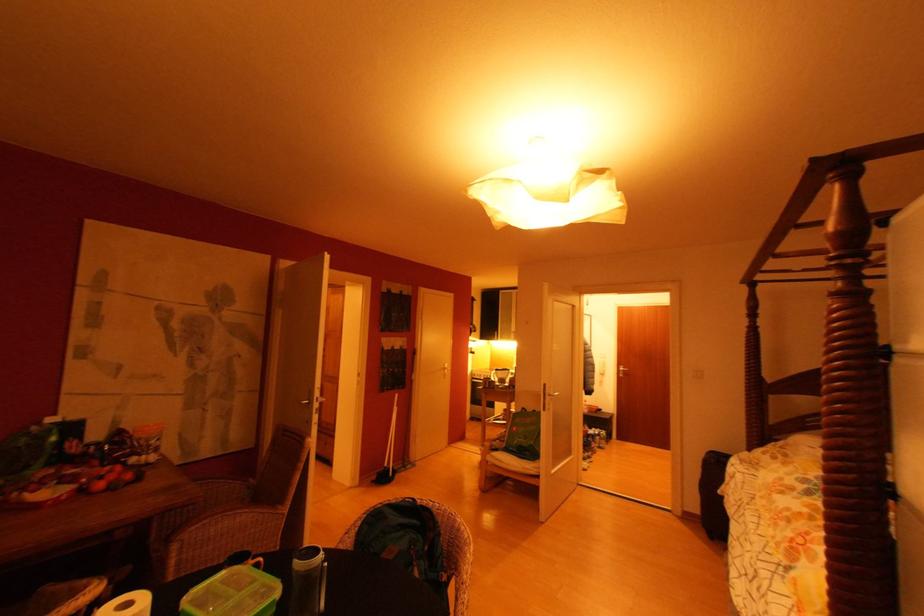
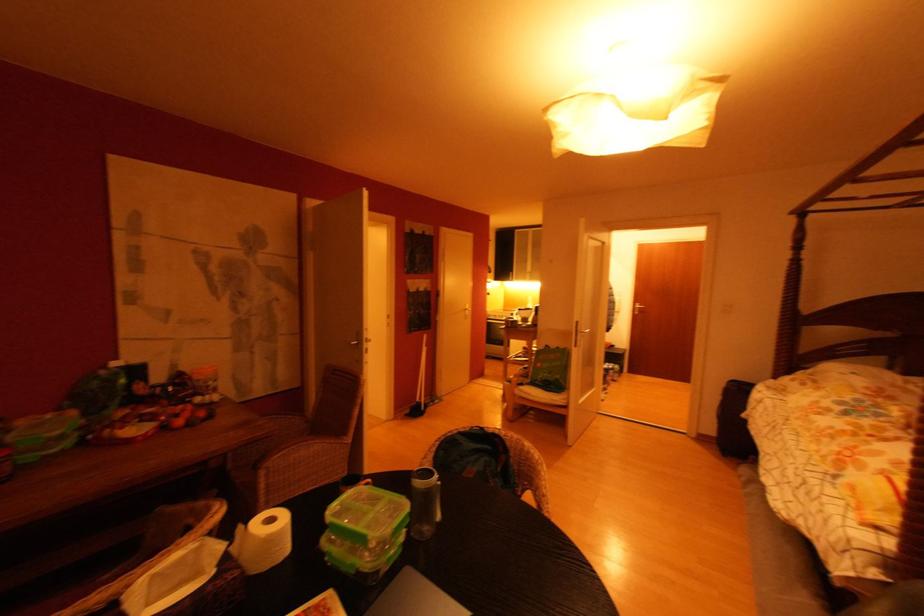
Question: Which direction would the cameraman need to move to produce the second image? Reply with the corresponding letter.

Choices:
 (A) Left
 (B) Right
 (C) Forward
 (D) Backward

Answer: (A)